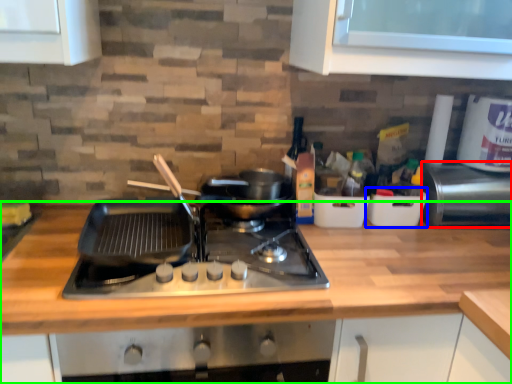
Question: Considering the real-world distances, which object is closest to appliance (highlighted by a red box)? appliance (highlighted by a blue box) or countertop (highlighted by a green box).

Choices:
 (A) appliance
 (B) countertop

Answer: (A)